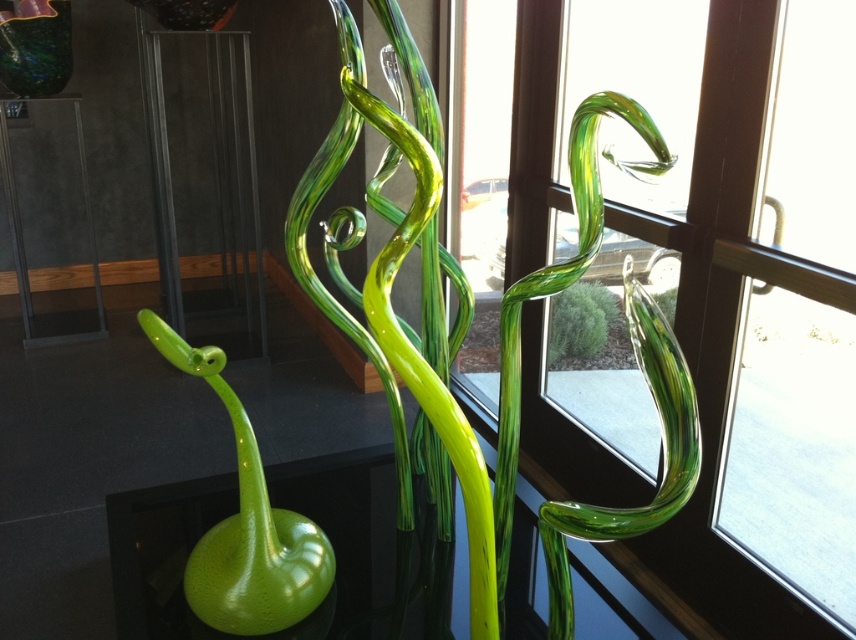
Question: Estimate the real-world distances between objects in this image. Which object is closer to the transparent glass sculpture at center?

Choices:
 (A) shiny multicolored glass vase at upper left
 (B) green glass plant at center
 (C) green glass sculpture at center
 (D) matte black table at left

Answer: (B)

Question: Is shiny multicolored glass vase at upper left above green glass plant at center?

Choices:
 (A) no
 (B) yes

Answer: (B)

Question: Can you confirm if green glass sculpture at center is wider than shiny multicolored glass vase at upper left?

Choices:
 (A) yes
 (B) no

Answer: (A)

Question: Does shiny multicolored glass vase at upper left have a larger size compared to green glass plant at center?

Choices:
 (A) no
 (B) yes

Answer: (A)

Question: Which object appears farthest from the camera in this image?

Choices:
 (A) shiny multicolored glass vase at upper left
 (B) green glass sculpture at center
 (C) transparent glass sculpture at center

Answer: (A)

Question: Estimate the real-world distances between objects in this image. Which object is farther from the green glass sculpture at center?

Choices:
 (A) transparent glass sculpture at center
 (B) shiny multicolored glass vase at upper left

Answer: (B)